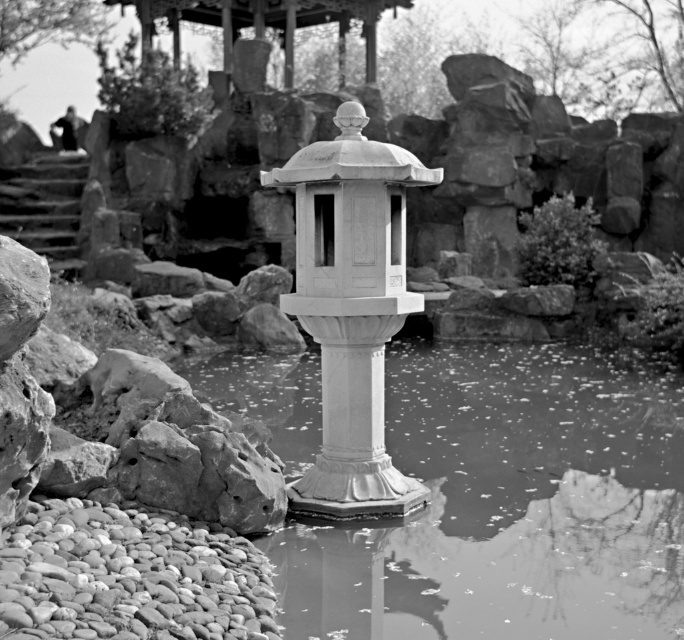
You are standing in the garden and want to place a 1.5 meter long wooden bench between yourself and the white stone lantern at center. Can you fit the bench in the space without moving the lantern?

The distance between you and the white stone lantern at center is 7.98 meters. Since the bench is only 1.5 meters long, there is sufficient space to place it between you and the lantern without needing to move the lantern.

You are standing at the edge of the pond in the garden scene. There is a point marked at coordinates point (x=508, y=506). Based on the description, where is this point located?

The point (x=508, y=506) is on the translucent glass water at center.